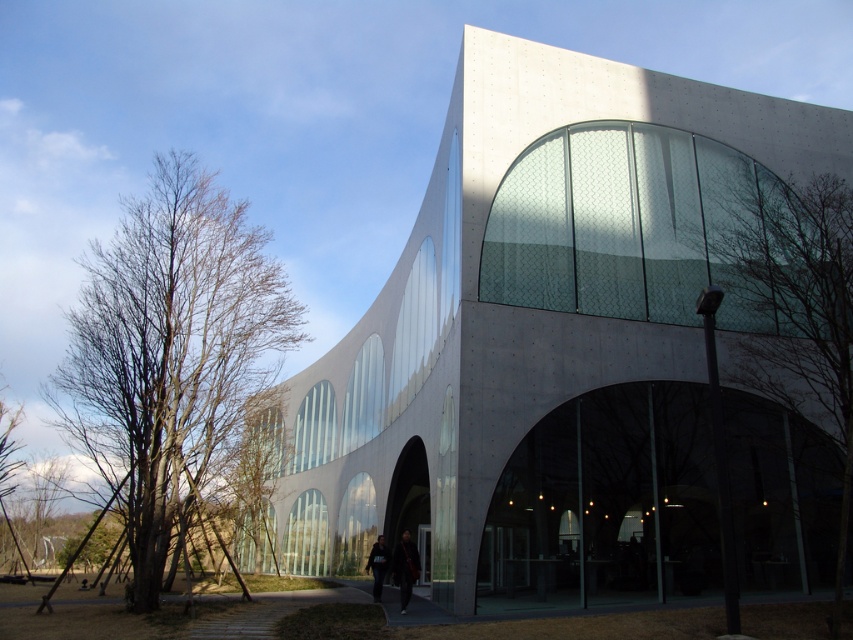
Which is behind, point (837, 435) or point (387, 568)?

The point (387, 568) is more distant.

Identify the location of green leafless tree at right. (799, 310).

Does green leafless tree at right have a smaller size compared to dark gray fabric jacket at center?

No.

Between green leafless tree at right and dark gray fabric jacket at center, which one is positioned higher?

green leafless tree at right

Find the location of a particular element. The width and height of the screenshot is (853, 640). green leafless tree at right is located at coordinates (799, 310).

This screenshot has height=640, width=853. What do you see at coordinates (544, 340) in the screenshot?
I see `white concrete building at center` at bounding box center [544, 340].

This screenshot has width=853, height=640. Describe the element at coordinates (544, 340) in the screenshot. I see `white concrete building at center` at that location.

Where is `white concrete building at center`? The image size is (853, 640). white concrete building at center is located at coordinates (544, 340).